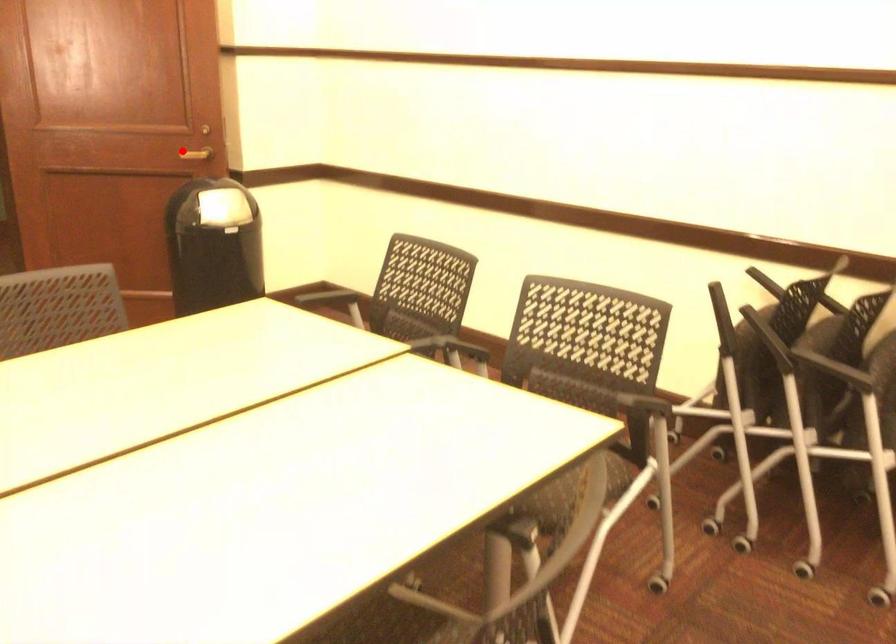
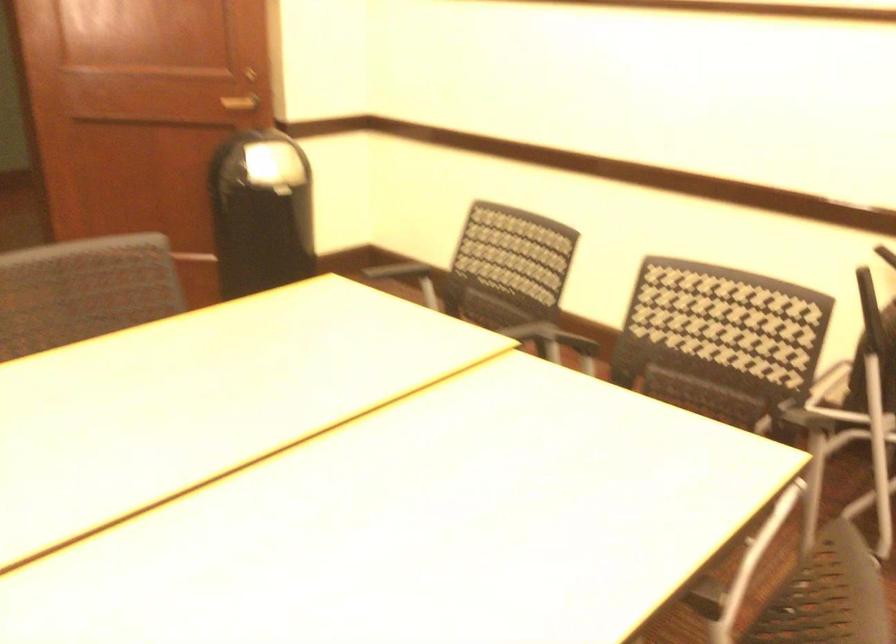
In the second image, find the point that corresponds to the highlighted location in the first image.

(240, 102)